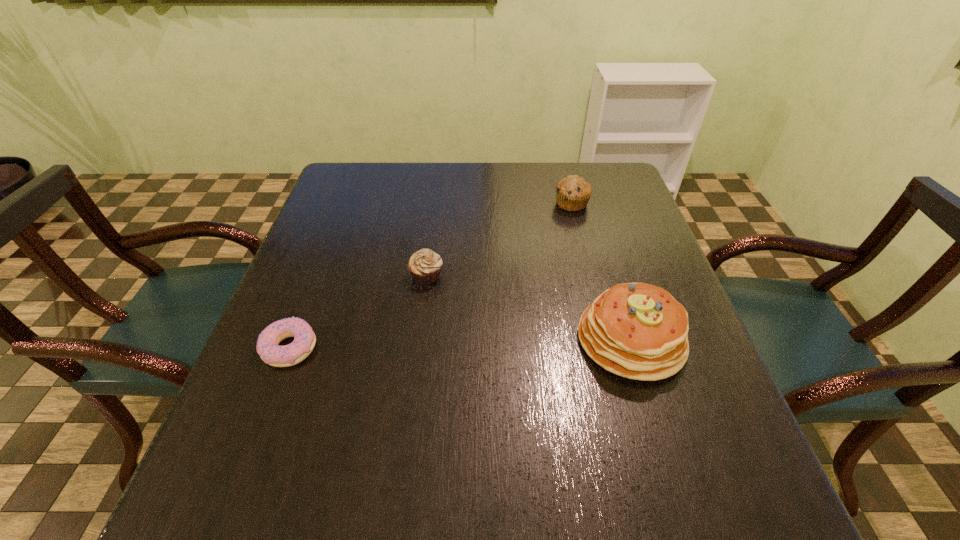
This screenshot has width=960, height=540. In the image, there is a desktop. Identify the location of vacant region at the far left corner. (373, 190).

The height and width of the screenshot is (540, 960). I want to click on vacant region between the second tallest object and the second object from left to right, so click(499, 239).

Locate an element on the screen. vacant area between the leftmost object and the nearer muffin is located at coordinates (358, 311).

You are a GUI agent. You are given a task and a screenshot of the screen. Output one action in this format:
    pyautogui.click(x=<x>, y=<y>)
    Task: Click on the free space between the pancake and the nearer muffin
    The image size is (960, 540).
    Given the screenshot: What is the action you would take?
    pyautogui.click(x=529, y=307)

The image size is (960, 540). What are the coordinates of `blank region between the doughnut and the second farthest object` in the screenshot? It's located at click(x=358, y=311).

I want to click on vacant space that is in between the doughnut and the second shortest object, so click(358, 311).

At what (x,y) coordinates should I click in order to perform the action: click on free spot between the pancake and the right muffin. Please return your answer as a coordinate pair (x, y). The image size is (960, 540). Looking at the image, I should click on (601, 272).

Where is `free space between the tallest object and the second farthest object`? The image size is (960, 540). free space between the tallest object and the second farthest object is located at coordinates (529, 307).

Image resolution: width=960 pixels, height=540 pixels. I want to click on free space between the farthest object and the shorter muffin, so click(499, 239).

You are a GUI agent. You are given a task and a screenshot of the screen. Output one action in this format:
    pyautogui.click(x=<x>, y=<y>)
    Task: Click on the vacant region between the left muffin and the farther muffin
    This screenshot has width=960, height=540.
    Given the screenshot: What is the action you would take?
    pyautogui.click(x=499, y=239)